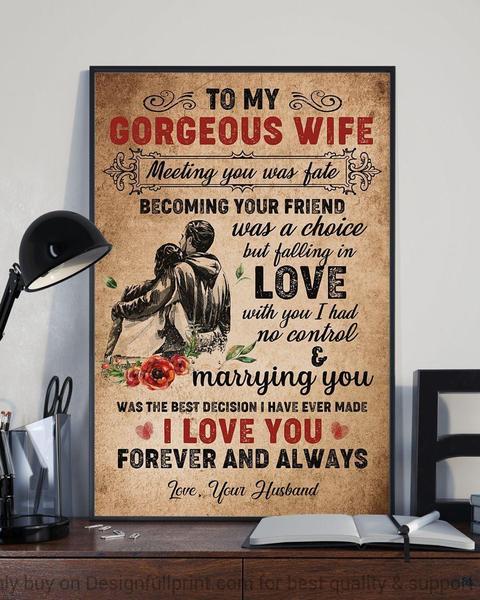
This screenshot has width=480, height=600. I want to click on chairs, so click(424, 392).